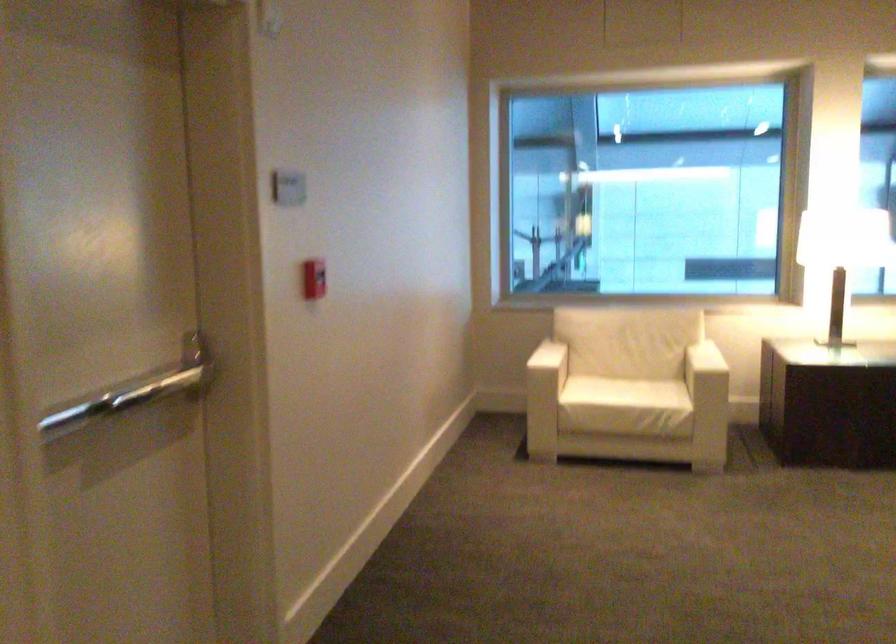
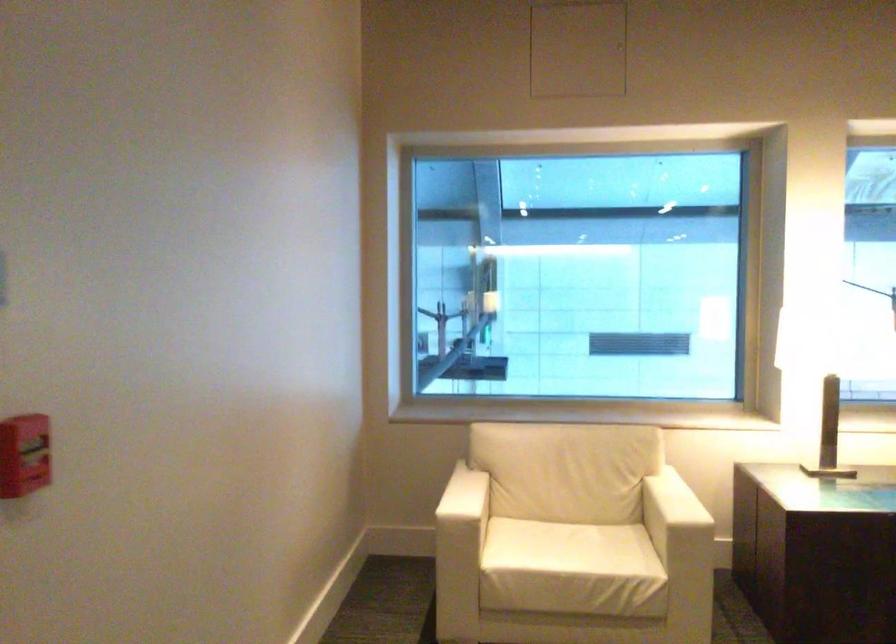
The point at (624, 386) is marked in the first image. Where is the corresponding point in the second image?

(566, 547)